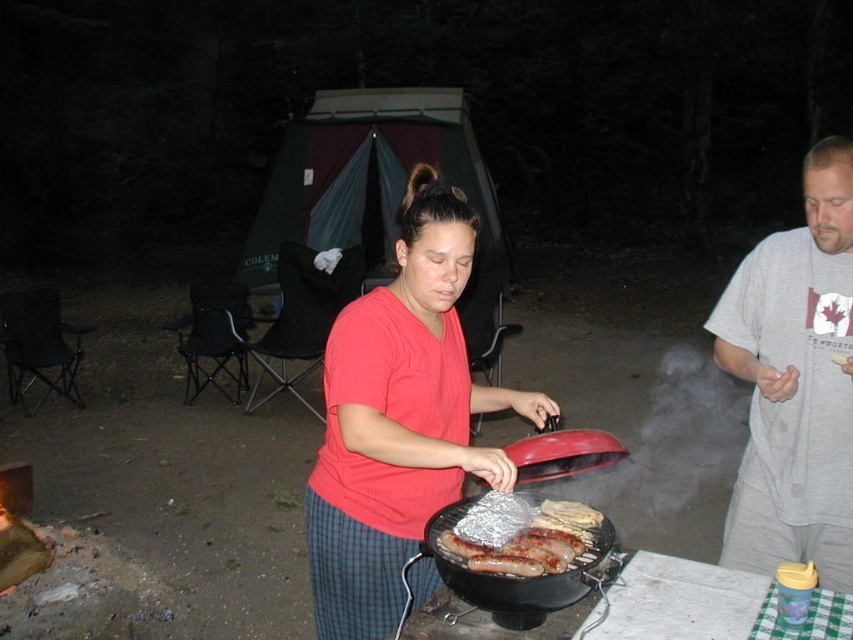
You are a photographer trying to capture the red matte shirt at center in the image. What are the coordinates where you should focus your camera?

The coordinates to focus on are point (399, 419).